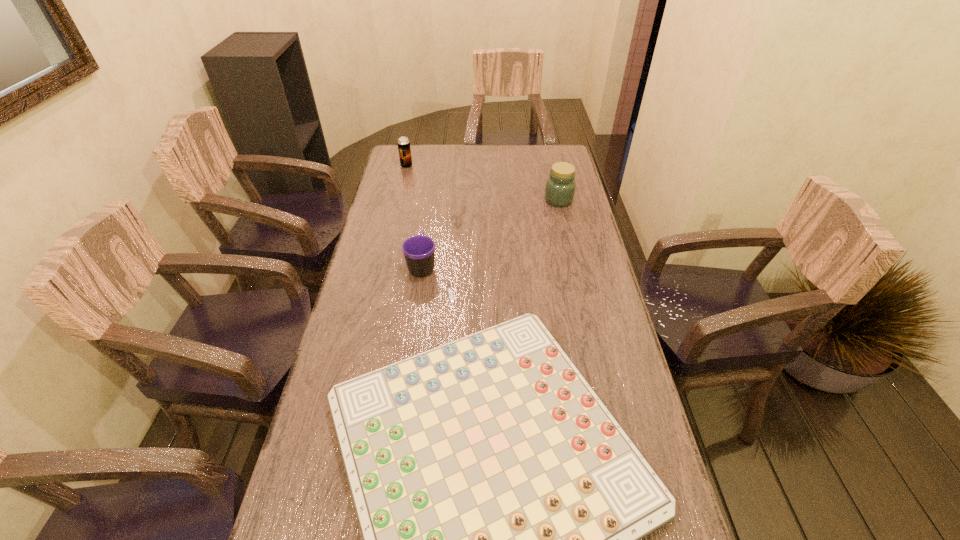
Identify the location of beer can that is at the left edge. (404, 149).

I want to click on mug at the left edge, so click(419, 251).

Image resolution: width=960 pixels, height=540 pixels. In order to click on object located in the right edge section of the desktop in this screenshot , I will do `click(560, 187)`.

At what (x,y) coordinates should I click in order to perform the action: click on object located in the far left corner section of the desktop. Please return your answer as a coordinate pair (x, y). Looking at the image, I should click on (404, 149).

Locate an element on the screen. free point at the far edge is located at coordinates (434, 162).

Locate an element on the screen. The width and height of the screenshot is (960, 540). vacant space at the left edge is located at coordinates pos(328,480).

Find the location of a particular element. The width and height of the screenshot is (960, 540). free space at the right edge of the desktop is located at coordinates (655, 532).

Find the location of a particular element. This screenshot has height=540, width=960. vacant area at the far left corner is located at coordinates (423, 153).

In the image, there is a desktop. What are the coordinates of `vacant space at the far right corner` in the screenshot? It's located at (564, 154).

The width and height of the screenshot is (960, 540). Find the location of `free spot between the farthest object and the jar`. free spot between the farthest object and the jar is located at coordinates (483, 183).